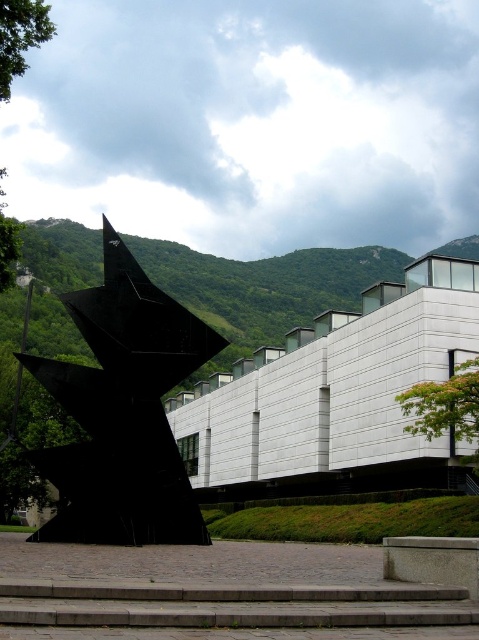
Where is the black polished sculpture at center located in the image?

The black polished sculpture at center is located at point (123, 412) in the image.

Based on the photo, you are standing in front of the modern building and see the black polished sculpture at center and the green leafy hillside at left. Which object is positioned lower in the scene?

The black polished sculpture at center is positioned below the green leafy hillside at left, so it is lower in the scene.

You are standing at the entrance of the modern building and want to reach the black polished sculpture at center. Which direction should you move relative to the gray concrete stairs at lower center?

The black polished sculpture at center is positioned on the left side of the gray concrete stairs at lower center, so you should move to the left of the gray concrete stairs at lower center to reach it.